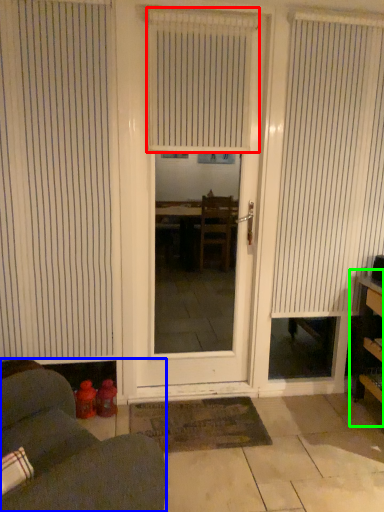
Question: Based on their relative distances, which object is farther from window blind (highlighted by a red box)? Choose from furniture (highlighted by a blue box) and bookshelf (highlighted by a green box).

Choices:
 (A) furniture
 (B) bookshelf

Answer: (A)